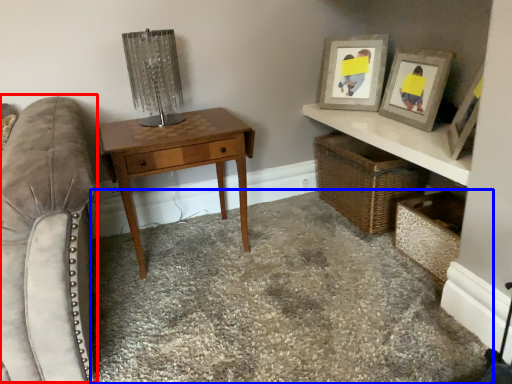
Question: Which object appears closest to the camera in this image, swivel chair (highlighted by a red box) or concrete (highlighted by a blue box)?

Choices:
 (A) swivel chair
 (B) concrete

Answer: (A)